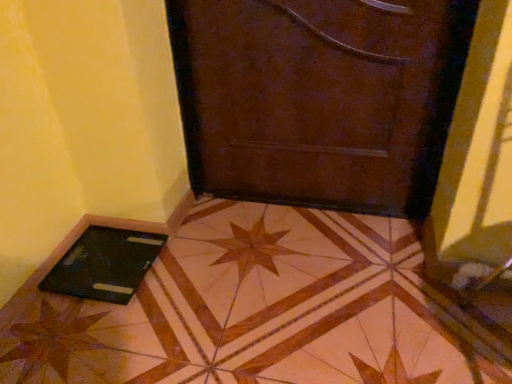
Question: Would you say brown leather door at center is to the left or to the right of black glossy laptop at lower left in the picture?

Choices:
 (A) left
 (B) right

Answer: (B)

Question: From the image's perspective, is brown leather door at center located above or below black glossy laptop at lower left?

Choices:
 (A) below
 (B) above

Answer: (B)

Question: Which of these objects is positioned farthest from the brown leather door at center?

Choices:
 (A) black matte tablet at lower left
 (B) black glossy laptop at lower left

Answer: (A)

Question: Which of these objects is positioned closest to the brown leather door at center?

Choices:
 (A) black matte tablet at lower left
 (B) black glossy laptop at lower left

Answer: (B)